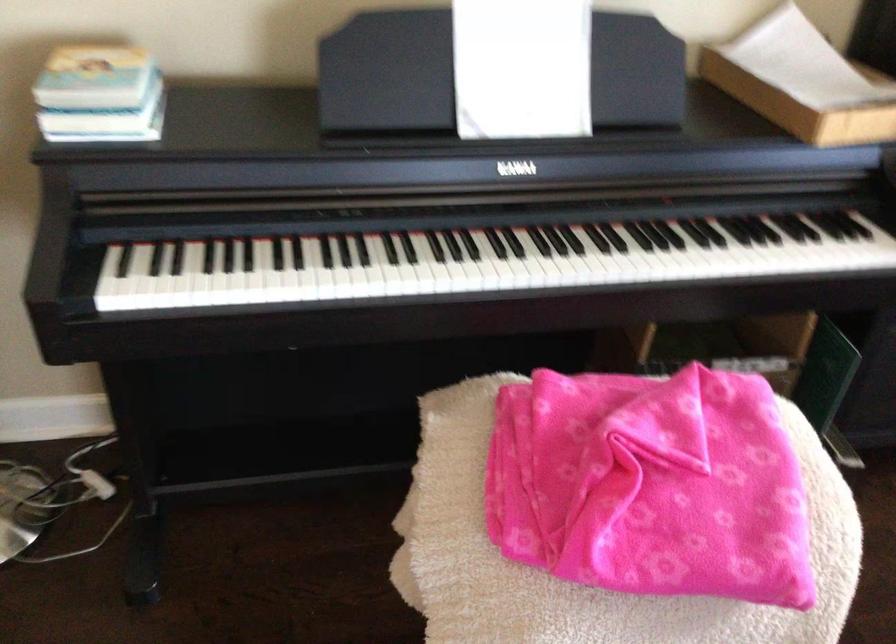
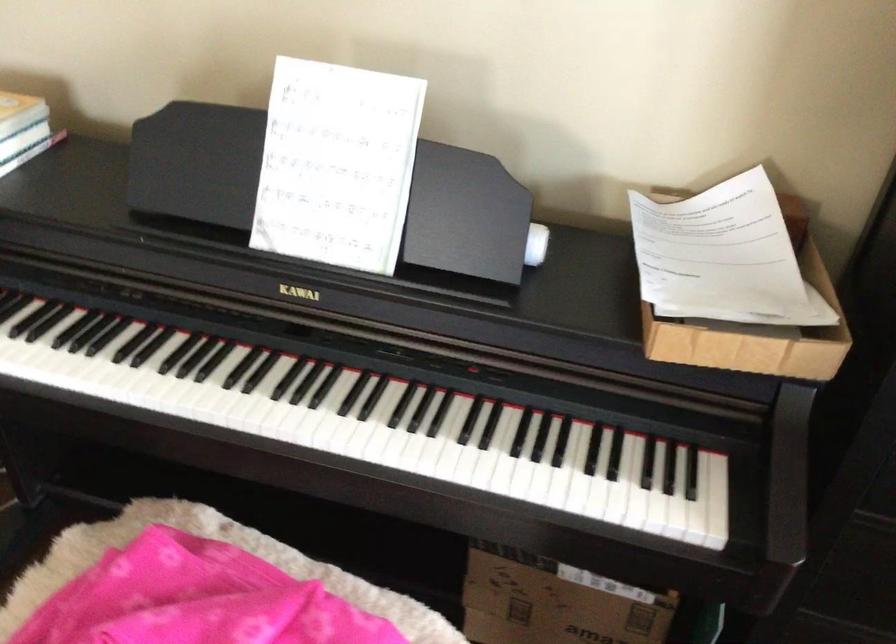
The point at (681, 84) is marked in the first image. Where is the corresponding point in the second image?

(536, 243)